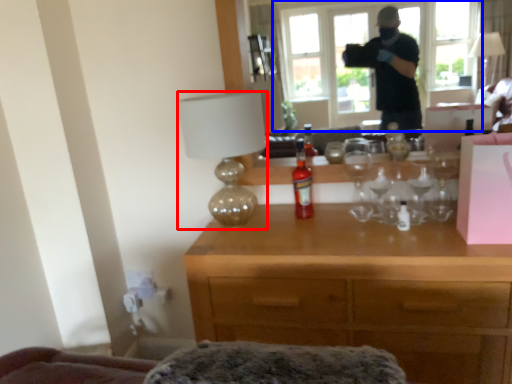
Question: Which point is further to the camera, lamp (highlighted by a red box) or window (highlighted by a blue box)?

Choices:
 (A) lamp
 (B) window

Answer: (A)